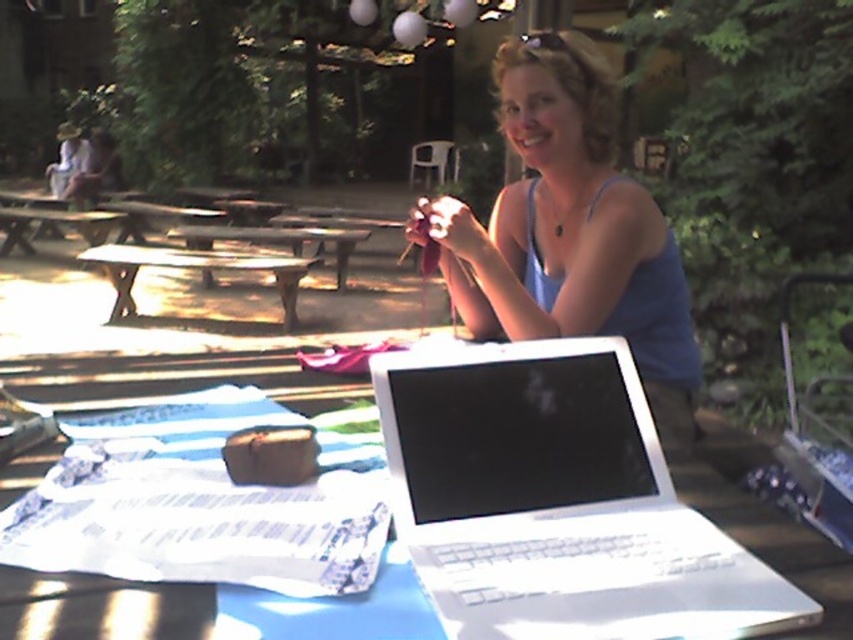
Question: Based on their relative distances, which object is nearer to the wooden picnic table at center?

Choices:
 (A) white plastic laptop at center
 (B) white plastic table at center
 (C) blue fabric tank top at center

Answer: (C)

Question: Is white plastic laptop at center behind blue fabric tank top at center?

Choices:
 (A) no
 (B) yes

Answer: (A)

Question: Which of the following is the closest to the observer?

Choices:
 (A) (19, 243)
 (B) (555, 240)
 (C) (381, 561)

Answer: (C)

Question: Is blue fabric tank top at center smaller than wooden picnic table at center?

Choices:
 (A) yes
 (B) no

Answer: (A)

Question: Which of the following is the closest to the observer?

Choices:
 (A) (335, 632)
 (B) (216, 257)

Answer: (A)

Question: Can you confirm if white plastic laptop at center is positioned to the left of wooden picnic table at center?

Choices:
 (A) yes
 (B) no

Answer: (B)